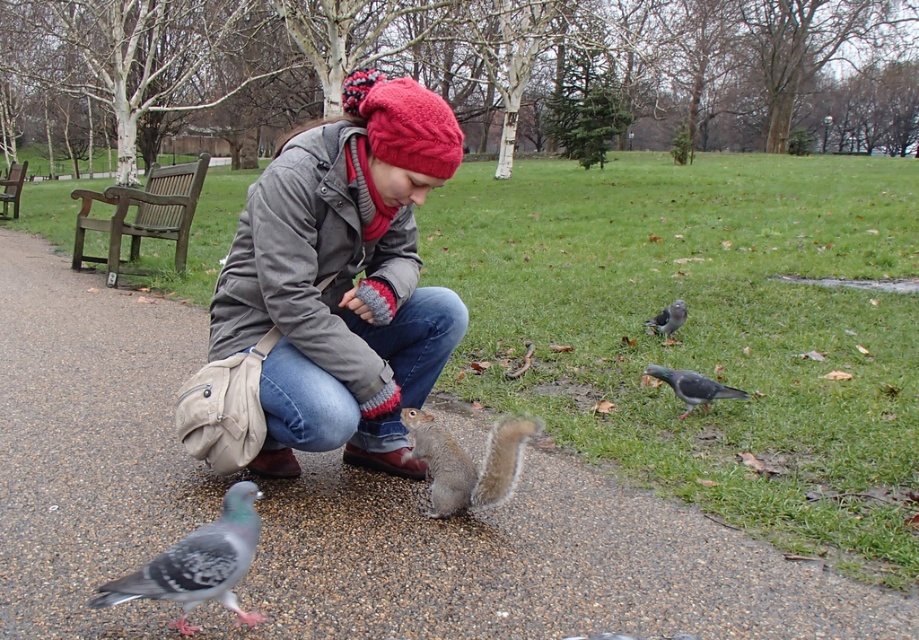
You are a park visitor trying to decide between feeding the speckled gray pigeon at lower left and the gray speckled pigeon at lower right. Which one is closer to you?

The speckled gray pigeon at lower left might be wider than gray speckled pigeon at lower right, but the question is about proximity. Since the description doesn not specify distance, we can infer from their positions that both are in lower areas. However, without explicit distance data, the answer cannot be determined based on the given information.

You are a photographer aiming to capture a clear photo of the gray furry squirrel at center without the gravel path at center obstructing the view. Is this possible based on their positions?

The gravel path at center is closer to the viewer than the gray furry squirrel at center, so the squirrel would be partially hidden behind the path, making it difficult to capture a clear photo without obstruction.

You are standing at the origin point in the park scene. The gray furry squirrel at center is located at coordinates 0.722 on the x axis and 0.509 on the y axis. If you want to walk directly towards the squirrel, in which general direction should you move? Please answer with either north, south, east, or west.

The gray furry squirrel at center is located at coordinates 0.722 on the x axis and 0.509 on the y axis. Since the x coordinate is greater than 0.5, you should move east to reach it.